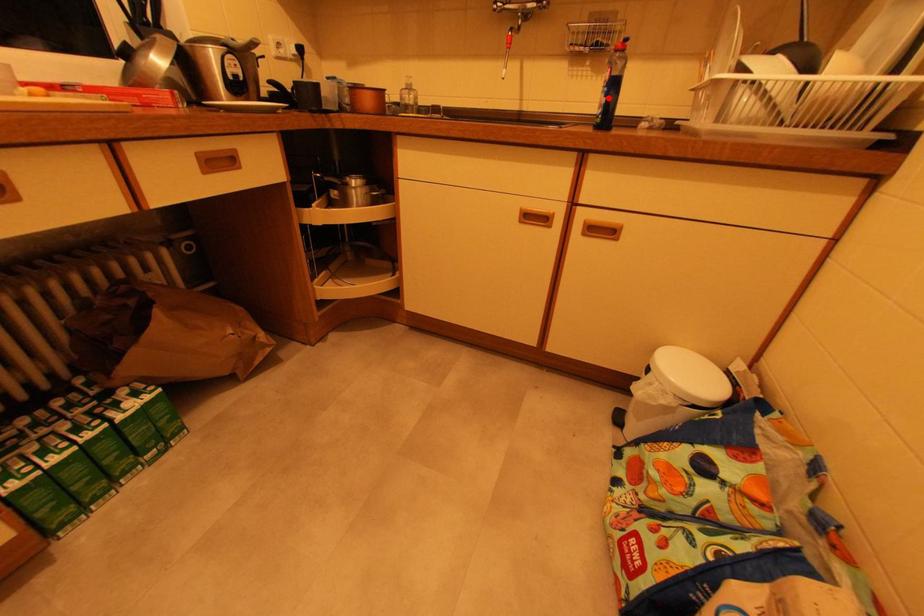
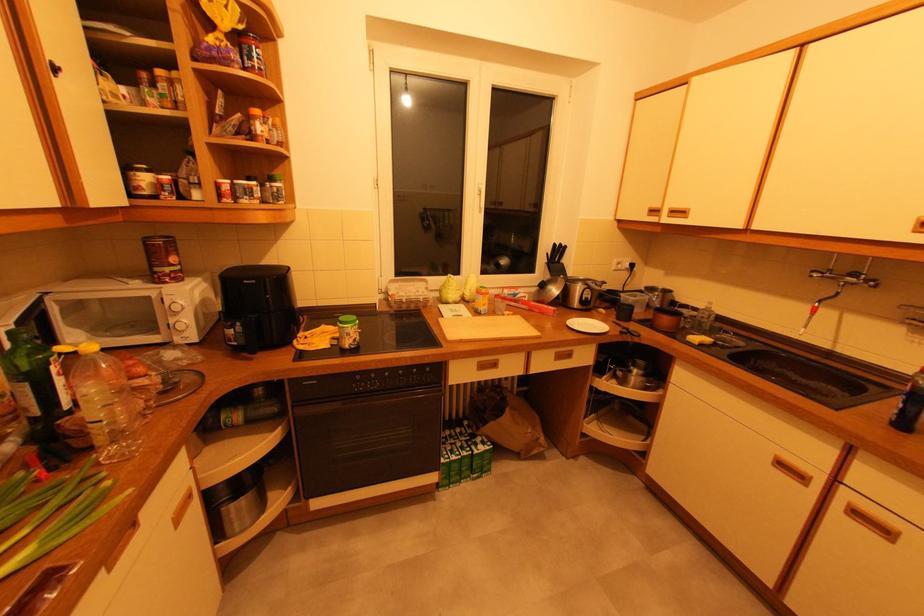
The point at the highlighted location is marked in the first image. Where is the corresponding point in the second image?

(907, 403)